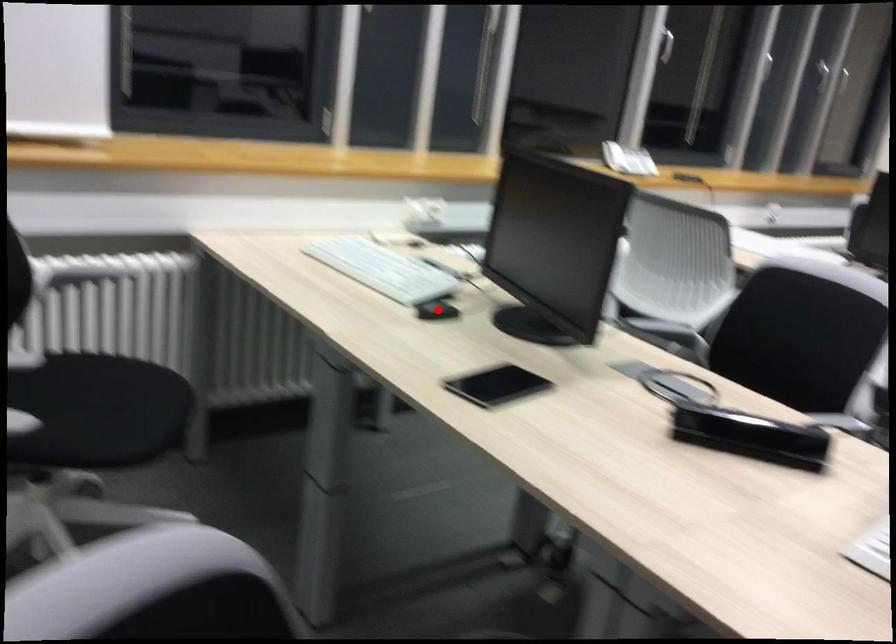
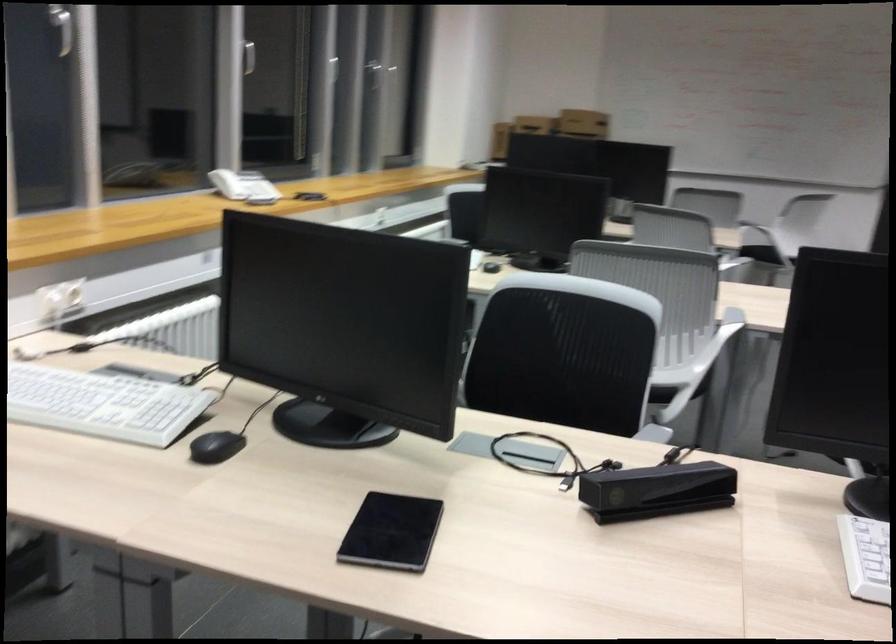
In the second image, find the point that corresponds to the highlighted location in the first image.

(216, 447)